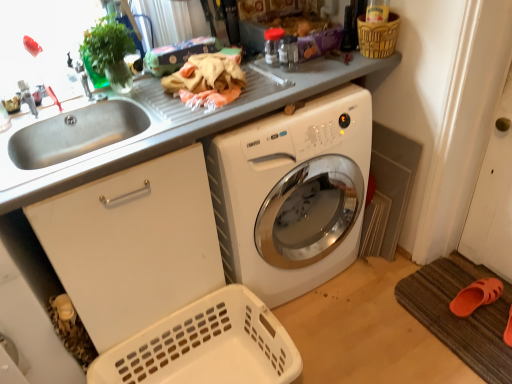
Question: Is brushed metal faucet at upper left looking in the opposite direction of white glossy washing machine at center?

Choices:
 (A) no
 (B) yes

Answer: (A)

Question: Is brushed metal faucet at upper left positioned before white glossy washing machine at center?

Choices:
 (A) no
 (B) yes

Answer: (A)

Question: From the image's perspective, is brushed metal faucet at upper left under white glossy washing machine at center?

Choices:
 (A) yes
 (B) no

Answer: (B)

Question: Can you confirm if brushed metal faucet at upper left is taller than white glossy washing machine at center?

Choices:
 (A) no
 (B) yes

Answer: (A)

Question: From a real-world perspective, does brushed metal faucet at upper left sit lower than white glossy washing machine at center?

Choices:
 (A) yes
 (B) no

Answer: (B)

Question: From the image's perspective, relative to white plastic basket at lower left, the 1th basket viewed from the left, is brushed metal faucet at upper left above or below?

Choices:
 (A) above
 (B) below

Answer: (A)

Question: In the image, is brushed metal faucet at upper left on the left side or the right side of white plastic basket at lower left, the 1th basket viewed from the left?

Choices:
 (A) right
 (B) left

Answer: (B)

Question: Do you think brushed metal faucet at upper left is within white plastic basket at lower left, the 1th basket viewed from the left, or outside of it?

Choices:
 (A) outside
 (B) inside

Answer: (A)

Question: From a real-world perspective, relative to white plastic basket at lower left, the 1th basket viewed from the left, is brushed metal faucet at upper left vertically above or below?

Choices:
 (A) below
 (B) above

Answer: (B)

Question: Considering the positions of white glossy washing machine at center and brushed metal faucet at upper left in the image, is white glossy washing machine at center bigger or smaller than brushed metal faucet at upper left?

Choices:
 (A) big
 (B) small

Answer: (A)

Question: Visually, is white glossy washing machine at center positioned to the left or to the right of brushed metal faucet at upper left?

Choices:
 (A) left
 (B) right

Answer: (B)

Question: Is white glossy washing machine at center inside or outside of brushed metal faucet at upper left?

Choices:
 (A) inside
 (B) outside

Answer: (B)

Question: From a real-world perspective, is white glossy washing machine at center above or below brushed metal faucet at upper left?

Choices:
 (A) above
 (B) below

Answer: (B)

Question: Considering the relative positions of stainless steel sink at left and brown textured bath mat at lower right in the image provided, is stainless steel sink at left to the left or to the right of brown textured bath mat at lower right?

Choices:
 (A) left
 (B) right

Answer: (A)

Question: Is point (126, 137) positioned closer to the camera than point (504, 316)?

Choices:
 (A) farther
 (B) closer

Answer: (B)